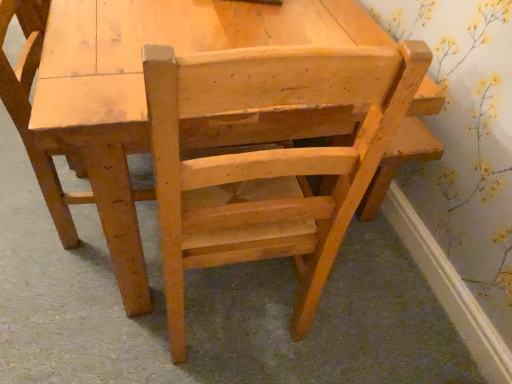
Question: Can you confirm if natural wood chair at center, positioned as the 2th chair in left-to-right order, is positioned to the left of light brown wood chair at center, placed as the second chair when sorted from right to left?

Choices:
 (A) yes
 (B) no

Answer: (B)

Question: Does natural wood chair at center, acting as the 1th chair starting from the right, turn towards light brown wood chair at center, marked as the 1th chair in a left-to-right arrangement?

Choices:
 (A) no
 (B) yes

Answer: (A)

Question: Does natural wood chair at center, acting as the 1th chair starting from the right, have a greater width compared to light brown wood chair at center, placed as the second chair when sorted from right to left?

Choices:
 (A) yes
 (B) no

Answer: (A)

Question: Are natural wood chair at center, positioned as the 2th chair in left-to-right order, and light brown wood chair at center, placed as the second chair when sorted from right to left, beside each other?

Choices:
 (A) no
 (B) yes

Answer: (A)

Question: Would you say natural wood chair at center, positioned as the 2th chair in left-to-right order, is a long distance from light brown wood chair at center, marked as the 1th chair in a left-to-right arrangement?

Choices:
 (A) no
 (B) yes

Answer: (A)

Question: Is natural wood chair at center, positioned as the 2th chair in left-to-right order, positioned with its back to light brown wood chair at center, marked as the 1th chair in a left-to-right arrangement?

Choices:
 (A) yes
 (B) no

Answer: (B)

Question: Is light brown wood chair at center, placed as the second chair when sorted from right to left, placed right next to natural wood chair at center, acting as the 1th chair starting from the right?

Choices:
 (A) yes
 (B) no

Answer: (B)

Question: Does light brown wood chair at center, marked as the 1th chair in a left-to-right arrangement, appear on the right side of natural wood chair at center, acting as the 1th chair starting from the right?

Choices:
 (A) no
 (B) yes

Answer: (A)

Question: Is light brown wood chair at center, marked as the 1th chair in a left-to-right arrangement, further to camera compared to natural wood chair at center, acting as the 1th chair starting from the right?

Choices:
 (A) no
 (B) yes

Answer: (B)

Question: Does light brown wood chair at center, placed as the second chair when sorted from right to left, have a smaller size compared to natural wood chair at center, positioned as the 2th chair in left-to-right order?

Choices:
 (A) no
 (B) yes

Answer: (B)

Question: Is natural wood chair at center, acting as the 1th chair starting from the right, at the back of light brown wood chair at center, marked as the 1th chair in a left-to-right arrangement?

Choices:
 (A) yes
 (B) no

Answer: (B)

Question: Is light brown wood chair at center, placed as the second chair when sorted from right to left, far away from natural wood chair at center, positioned as the 2th chair in left-to-right order?

Choices:
 (A) no
 (B) yes

Answer: (A)

Question: Is point (15, 92) closer or farther from the camera than point (128, 140)?

Choices:
 (A) farther
 (B) closer

Answer: (A)